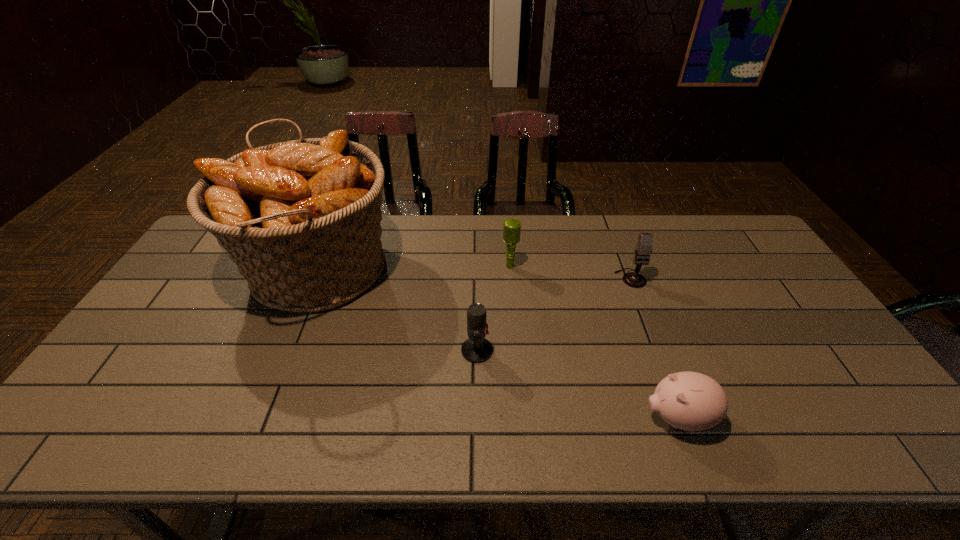
Image resolution: width=960 pixels, height=540 pixels. In order to click on free area in between the third object from right to left and the basket in this screenshot , I will do [414, 269].

Find the location of a particular element. This screenshot has width=960, height=540. vacant area that lies between the leftmost object and the rightmost microphone is located at coordinates pyautogui.click(x=474, y=274).

The image size is (960, 540). Find the location of `vacant space that is in between the third object from left to right and the shortest object`. vacant space that is in between the third object from left to right and the shortest object is located at coordinates (594, 342).

At what (x,y) coordinates should I click in order to perform the action: click on the second closest object to the leftmost object. Please return your answer as a coordinate pair (x, y). The height and width of the screenshot is (540, 960). Looking at the image, I should click on tap(512, 227).

Where is `object identified as the third closest to the second object from left to right`? The image size is (960, 540). object identified as the third closest to the second object from left to right is located at coordinates 691,401.

The image size is (960, 540). Find the location of `the second closest microphone to the piggy bank`. the second closest microphone to the piggy bank is located at coordinates (643, 249).

This screenshot has width=960, height=540. What are the coordinates of `microphone that is the second closest one to the third object from right to left` in the screenshot? It's located at tap(643, 249).

This screenshot has height=540, width=960. I want to click on free space that satisfies the following two spatial constraints: 1. on the front-facing side of the rightmost microphone; 2. on the side of the fourth object from right to left with the red ring, so click(x=658, y=350).

The image size is (960, 540). Identify the location of vacant region that satisfies the following two spatial constraints: 1. on the back side of the second microphone from right to left; 2. on the right side of the leftmost object. (319, 267).

This screenshot has width=960, height=540. I want to click on free spot that satisfies the following two spatial constraints: 1. on the front-facing side of the rightmost microphone; 2. on the side of the fourth object from right to left with the red ring, so click(x=658, y=350).